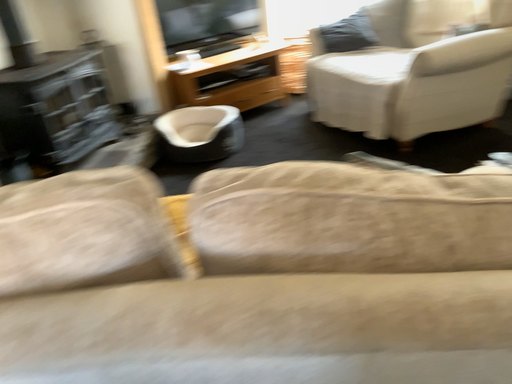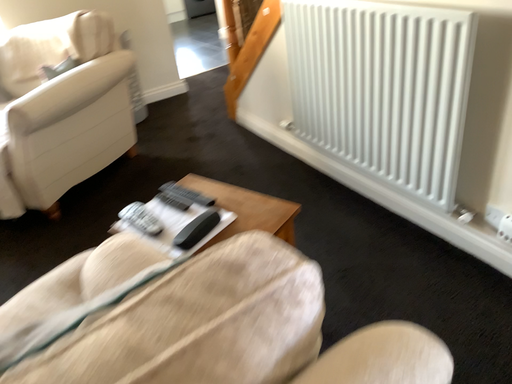
Question: Which way did the camera rotate in the video?

Choices:
 (A) rotated downward
 (B) rotated upward

Answer: (B)